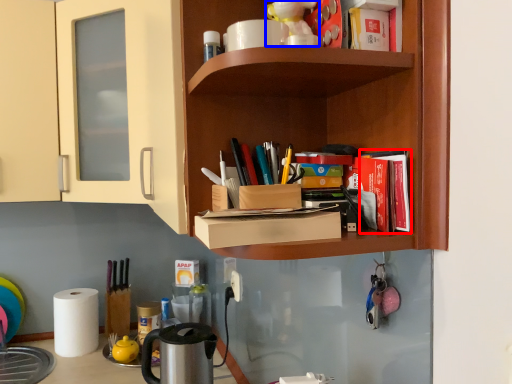
Question: Which of the following is the closest to the observer, book (highlighted by a red box) or toy (highlighted by a blue box)?

Choices:
 (A) book
 (B) toy

Answer: (A)